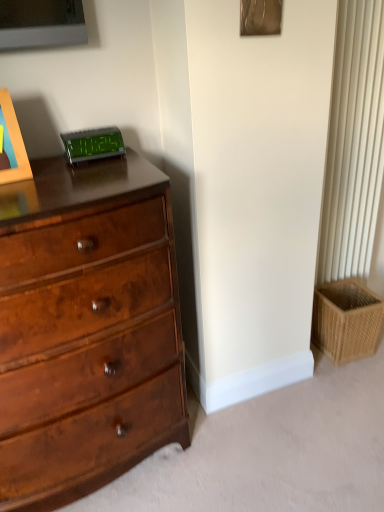
Where is `free space in front of woven tan basket at lower right`? This screenshot has width=384, height=512. free space in front of woven tan basket at lower right is located at coordinates (340, 393).